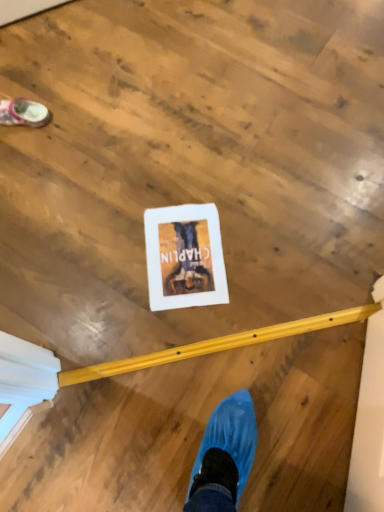
Find the location of a particular element. vacant area located to the right-hand side of white paper at center is located at coordinates (266, 251).